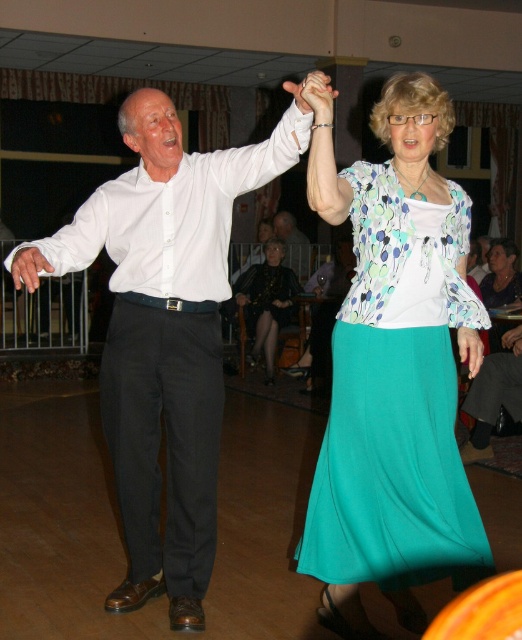
Question: Can you confirm if teal satin skirt at center is positioned above matte white hand at center?

Choices:
 (A) yes
 (B) no

Answer: (B)

Question: Does matte black shirt at upper center have a greater width compared to matte white hand at center?

Choices:
 (A) yes
 (B) no

Answer: (A)

Question: Which of the following is the closest to the observer?

Choices:
 (A) [362, 211]
 (B) [103, 186]
 (C) [290, 257]

Answer: (A)

Question: Estimate the real-world distances between objects in this image. Which object is closer to the matte black shirt at upper center?

Choices:
 (A) matte white hand at center
 (B) teal satin skirt at center

Answer: (B)

Question: Does teal satin skirt at center have a greater width compared to matte black shirt at upper center?

Choices:
 (A) no
 (B) yes

Answer: (B)

Question: Among these points, which one is nearest to the camera?

Choices:
 (A) click(272, 227)
 (B) click(386, 440)
 (C) click(200, 442)
 (D) click(315, 88)

Answer: (D)